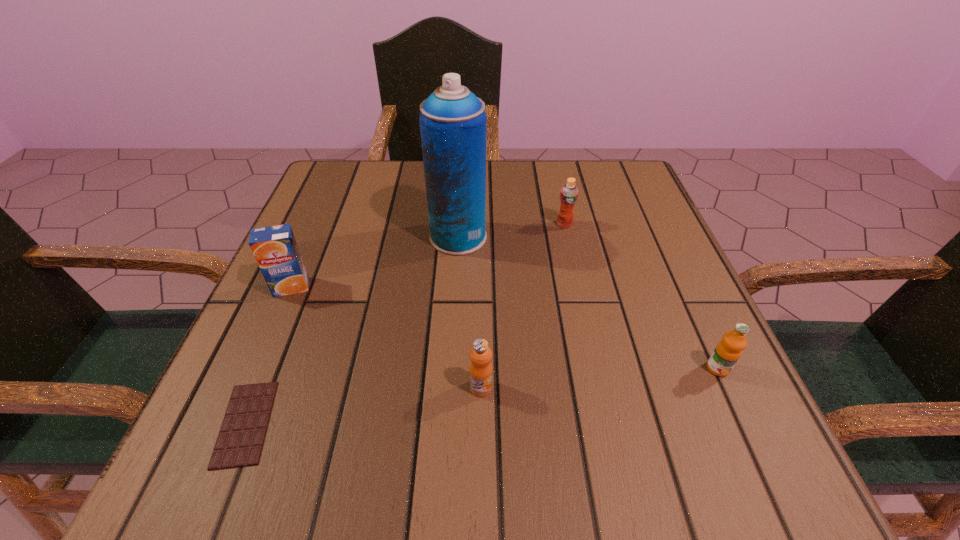
Locate an element on the screen. This screenshot has width=960, height=540. vacant position located 0.050m on the front of the second farthest orange juice is located at coordinates [x=277, y=318].

Identify the location of vacant space situated on the right of the farthest orange juice. This screenshot has width=960, height=540. (640, 224).

This screenshot has height=540, width=960. What are the coordinates of `vacant space located on the front label of the nearest orange juice` in the screenshot? It's located at (481, 487).

Identify the location of free space located 0.160m on the label of the rightmost object. (770, 483).

At what (x,y) coordinates should I click in order to perform the action: click on vacant area situated 0.250m on the right of the shortest object. Please return your answer as a coordinate pair (x, y). The height and width of the screenshot is (540, 960). Looking at the image, I should click on (446, 423).

Find the location of `object located at the near edge`. object located at the near edge is located at coordinates [x=240, y=440].

Find the location of a particular element. Image resolution: width=960 pixels, height=540 pixels. orange_juice positioned at the left edge is located at coordinates (275, 249).

What are the coordinates of `chocolate bar positioned at the left edge` in the screenshot? It's located at (240, 440).

Find the location of a particular element. Image resolution: width=960 pixels, height=540 pixels. object located at the right edge is located at coordinates (727, 352).

The image size is (960, 540). What are the coordinates of `object present at the near left corner` in the screenshot? It's located at (240, 440).